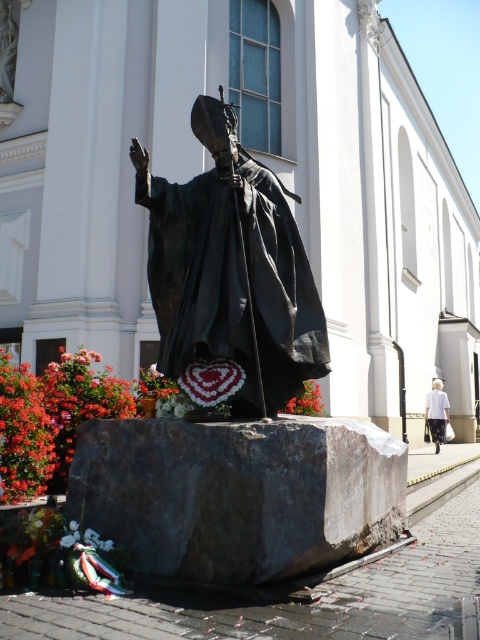
Question: Which of the following is the closest to the observer?

Choices:
 (A) (x=356, y=509)
 (B) (x=434, y=413)
 (C) (x=254, y=308)

Answer: (A)

Question: Does white stone church at center lie in front of bronze statue at center?

Choices:
 (A) yes
 (B) no

Answer: (B)

Question: Among these points, which one is farthest from the camera?

Choices:
 (A) (430, 413)
 (B) (82, 513)

Answer: (A)

Question: Which point is farther to the camera?

Choices:
 (A) bronze statue at center
 (B) white stone church at center
 (C) gray rough stone at center

Answer: (B)

Question: Is white stone church at center closer to the viewer compared to bronze statue at center?

Choices:
 (A) no
 (B) yes

Answer: (A)

Question: Is white stone church at center closer to camera compared to gray rough stone at center?

Choices:
 (A) no
 (B) yes

Answer: (A)